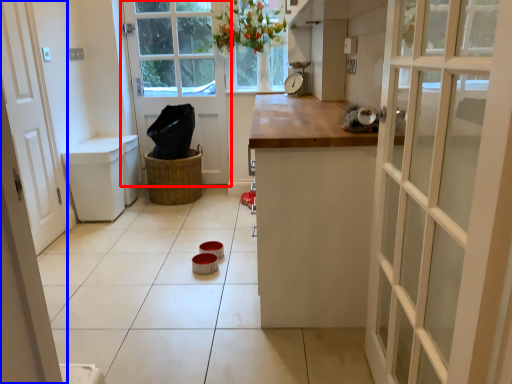
Question: Which point is closer to the camera, door (highlighted by a red box) or door (highlighted by a blue box)?

Choices:
 (A) door
 (B) door

Answer: (B)